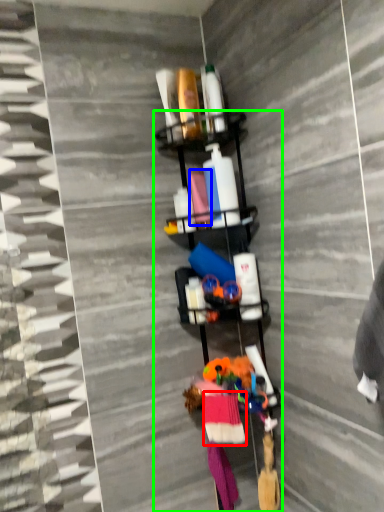
Question: Which is farther away from clothing (highlighted by a red box)? fabric (highlighted by a blue box) or shelf (highlighted by a green box)?

Choices:
 (A) fabric
 (B) shelf

Answer: (A)